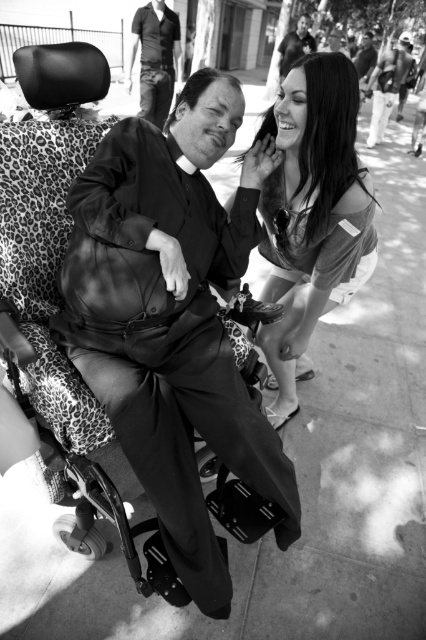
Question: Can you confirm if matte black suit at center is positioned above smooth fabric dress at upper right?

Choices:
 (A) no
 (B) yes

Answer: (A)

Question: Which is farther from the dark gray shirt at upper left?

Choices:
 (A) matte black suit at center
 (B) smooth leather jacket at upper center

Answer: (B)

Question: Is matte black suit at center bigger than smooth fabric dress at upper right?

Choices:
 (A) no
 (B) yes

Answer: (A)

Question: Which object is closer to the camera taking this photo?

Choices:
 (A) smooth leather jacket at upper center
 (B) smooth fabric dress at upper right
 (C) matte black suit at center
 (D) dark gray shirt at upper left

Answer: (C)

Question: Based on their relative distances, which object is nearer to the smooth leather jacket at upper center?

Choices:
 (A) dark gray shirt at upper left
 (B) matte black suit at center
 (C) smooth fabric dress at upper right

Answer: (A)

Question: From the image, what is the correct spatial relationship of dark gray shirt at upper left in relation to smooth leather jacket at upper center?

Choices:
 (A) left
 (B) right

Answer: (A)